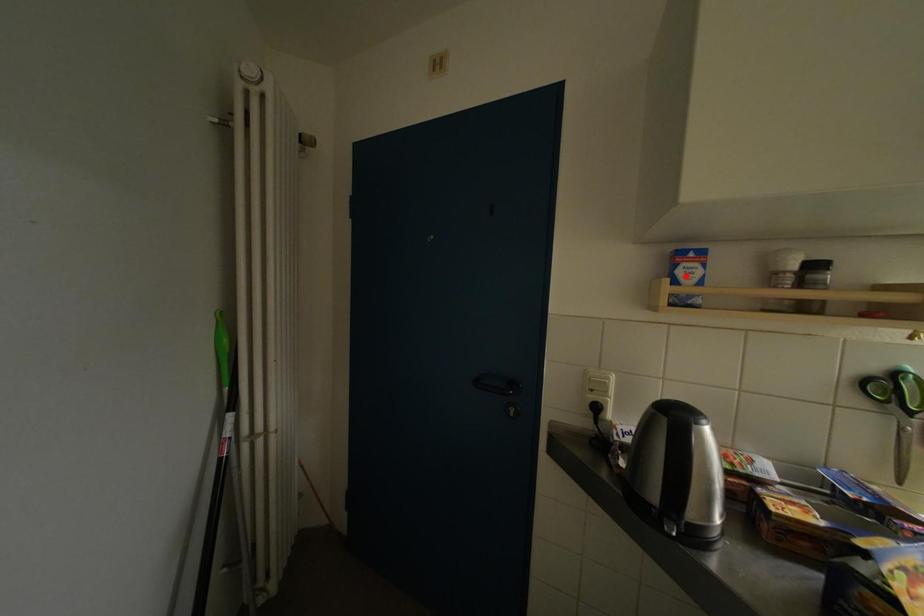
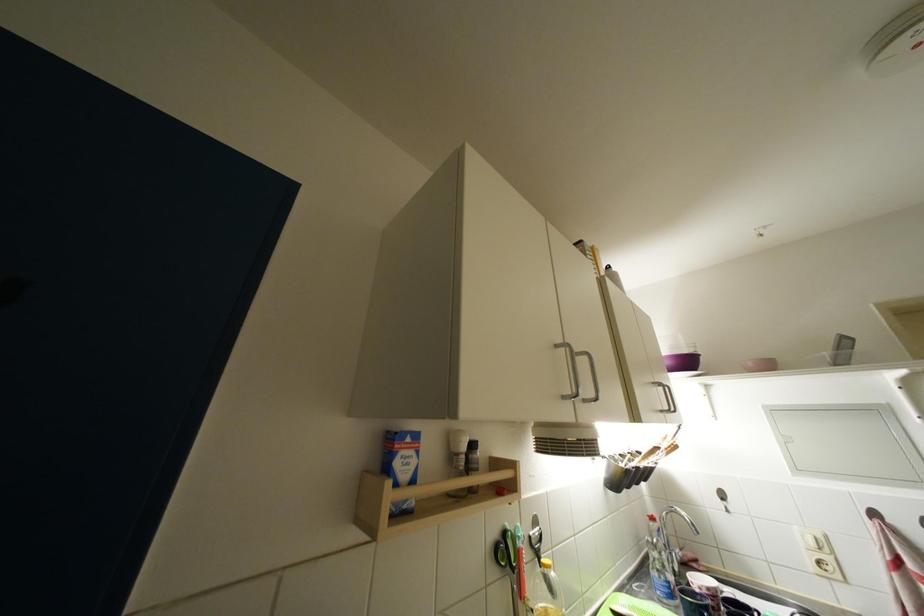
The point at the highlighted location is marked in the first image. Where is the corresponding point in the second image?

(404, 467)